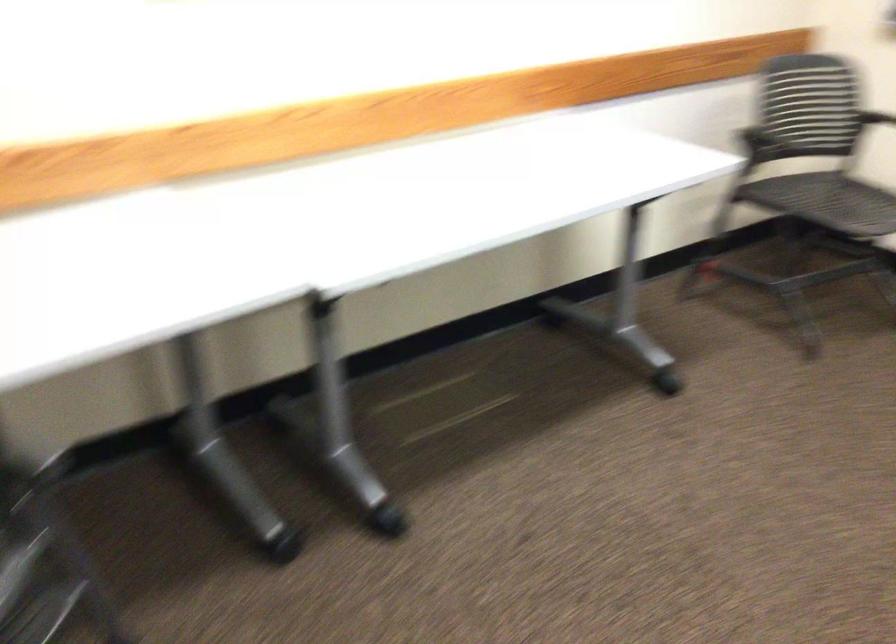
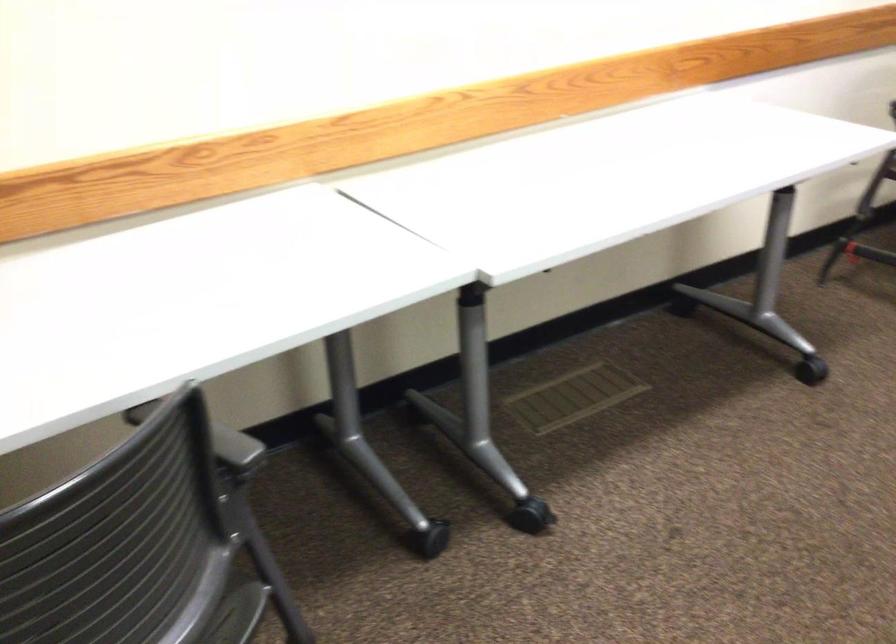
Question: The camera is either moving clockwise (left) or counter-clockwise (right) around the object. The first image is from the beginning of the video and the second image is from the end. Is the camera moving left or right when shooting the video?

Choices:
 (A) Left
 (B) Right

Answer: (B)